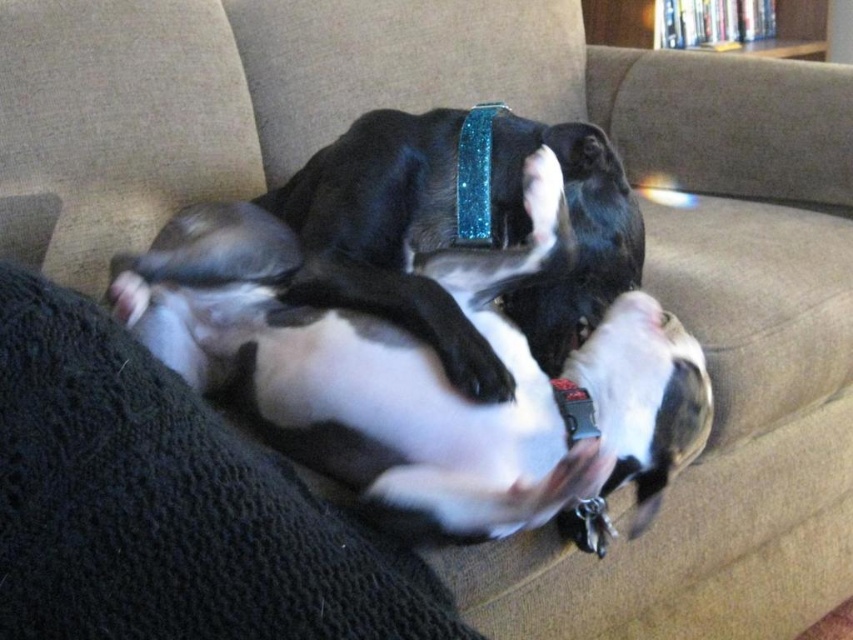
Question: Which point is farther to the camera?

Choices:
 (A) black shiny dog at center
 (B) glittery blue neckband at center

Answer: (A)

Question: Can you confirm if black knitted blanket at lower left is positioned to the left of glittery blue neckband at center?

Choices:
 (A) yes
 (B) no

Answer: (A)

Question: Among these objects, which one is nearest to the camera?

Choices:
 (A) black shiny dog at center
 (B) glittery blue neckband at center
 (C) black knitted blanket at lower left

Answer: (C)

Question: Is black knitted blanket at lower left above glittery blue neckband at center?

Choices:
 (A) yes
 (B) no

Answer: (B)

Question: Considering the relative positions of black knitted blanket at lower left and glittery blue neckband at center in the image provided, where is black knitted blanket at lower left located with respect to glittery blue neckband at center?

Choices:
 (A) above
 (B) below

Answer: (B)

Question: Which point is farther to the camera?

Choices:
 (A) (529, 317)
 (B) (589, 404)

Answer: (A)